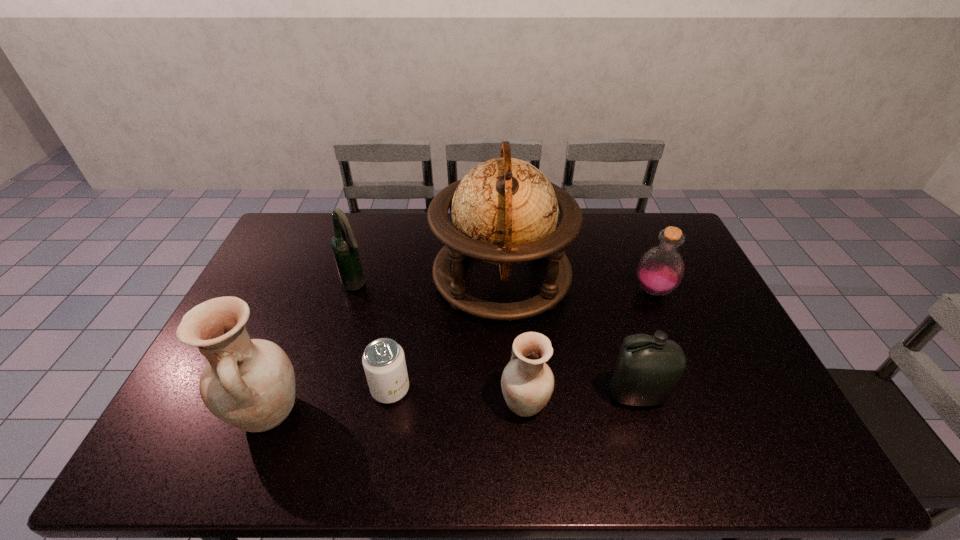
The width and height of the screenshot is (960, 540). In order to click on free space that satisfies the following two spatial constraints: 1. on the back side of the shortest object; 2. on the right side of the taller pottery in this screenshot , I will do `click(277, 389)`.

This screenshot has height=540, width=960. I want to click on vacant space that satisfies the following two spatial constraints: 1. on the front side of the fifth shortest object; 2. on the right side of the rightmost object, so click(x=354, y=291).